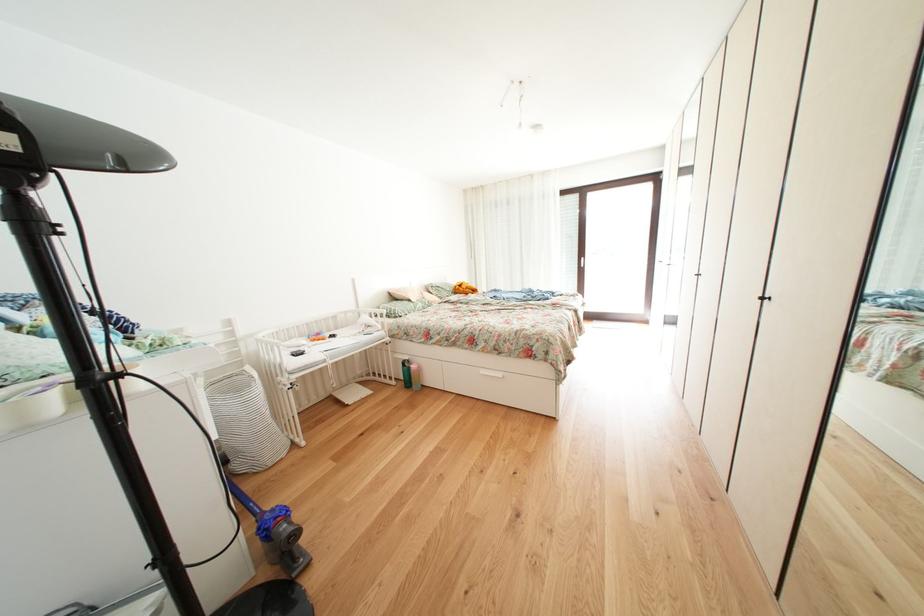
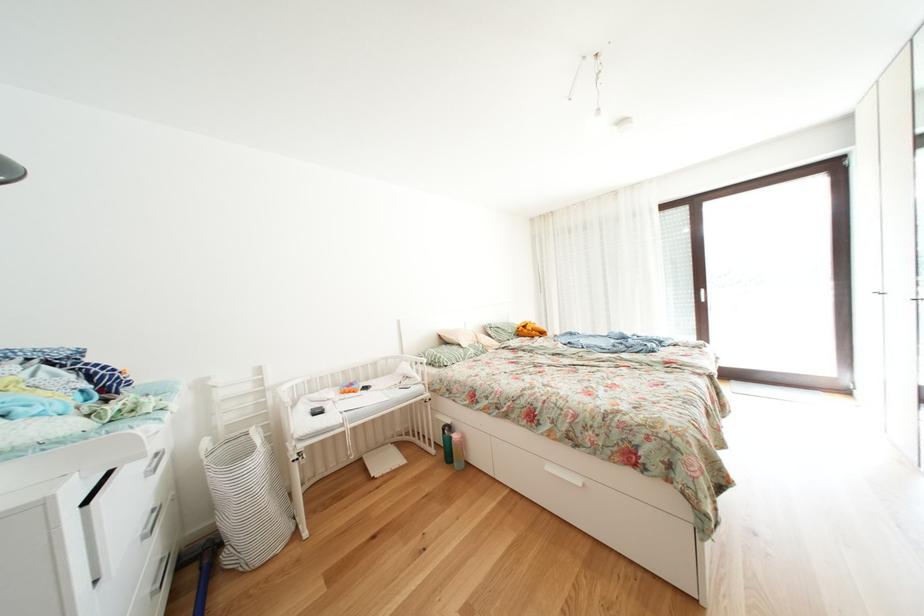
Question: What movement of the cameraman would produce the second image?

Choices:
 (A) Left
 (B) Right
 (C) Forward
 (D) Backward

Answer: (C)